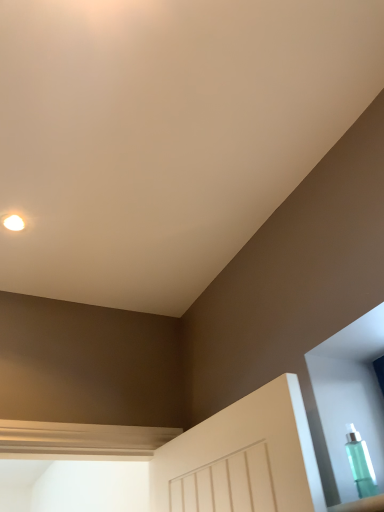
Question: Is matte white droplight at upper left wider or thinner than transparent plastic bottle at lower right?

Choices:
 (A) wide
 (B) thin

Answer: (A)

Question: From the image's perspective, is matte white droplight at upper left positioned above or below transparent plastic bottle at lower right?

Choices:
 (A) below
 (B) above

Answer: (B)

Question: Do you think matte white droplight at upper left is within transparent plastic bottle at lower right, or outside of it?

Choices:
 (A) inside
 (B) outside

Answer: (B)

Question: Considering the positions of point (364, 450) and point (6, 220), is point (364, 450) closer or farther from the camera than point (6, 220)?

Choices:
 (A) closer
 (B) farther

Answer: (A)

Question: Is transparent plastic bottle at lower right wider or thinner than matte white droplight at upper left?

Choices:
 (A) thin
 (B) wide

Answer: (A)

Question: From their relative heights in the image, would you say transparent plastic bottle at lower right is taller or shorter than matte white droplight at upper left?

Choices:
 (A) short
 (B) tall

Answer: (B)

Question: Relative to matte white droplight at upper left, is transparent plastic bottle at lower right in front or behind?

Choices:
 (A) front
 (B) behind

Answer: (A)